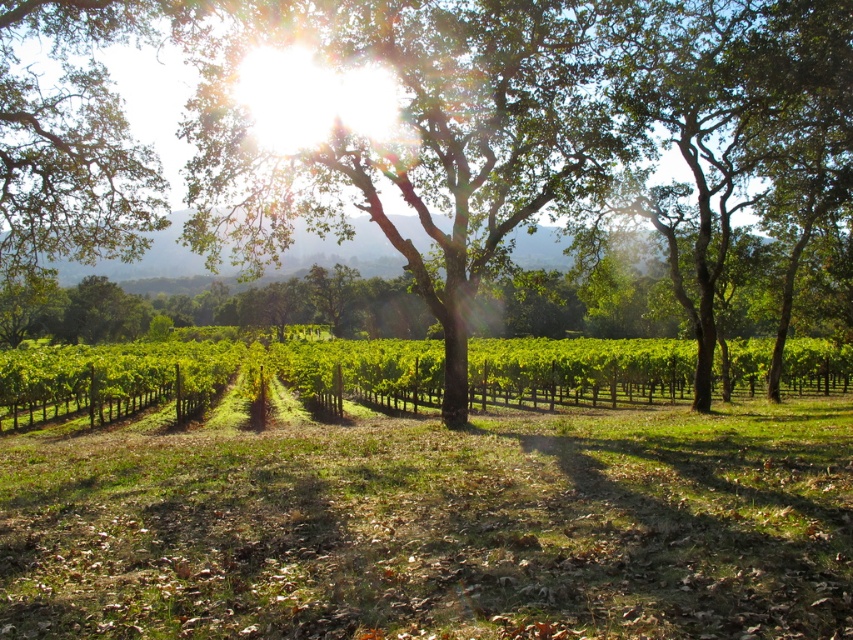
Question: Which point is closer to the camera?

Choices:
 (A) (418, 264)
 (B) (550, 401)

Answer: (A)

Question: Is the position of green leafy tree at center more distant than that of green leafy vines at center?

Choices:
 (A) no
 (B) yes

Answer: (A)

Question: Which of the following is the farthest from the observer?

Choices:
 (A) (682, 346)
 (B) (437, 67)

Answer: (A)

Question: Which point appears farthest from the camera in this image?

Choices:
 (A) (434, 380)
 (B) (457, 184)

Answer: (A)

Question: Can you confirm if green leafy tree at center is bigger than green leafy vines at center?

Choices:
 (A) no
 (B) yes

Answer: (B)

Question: Does green leafy tree at center appear over green leafy vines at center?

Choices:
 (A) yes
 (B) no

Answer: (A)